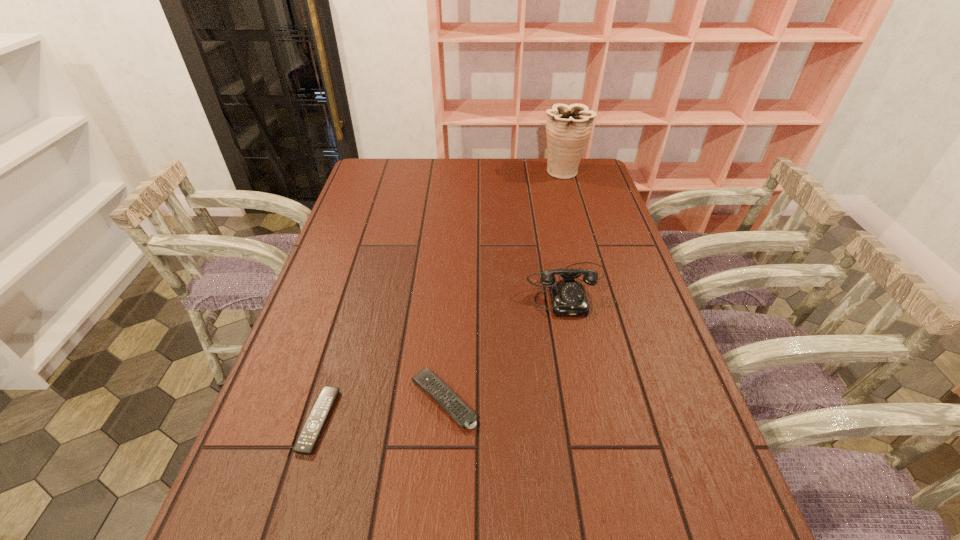
This screenshot has width=960, height=540. In order to click on vacant space in between the second farthest object and the left remote control in this screenshot , I will do `click(444, 354)`.

You are a GUI agent. You are given a task and a screenshot of the screen. Output one action in this format:
    pyautogui.click(x=<x>, y=<y>)
    Task: Click on the unoccupied area between the urn and the second farthest object
    The image size is (960, 540).
    Given the screenshot: What is the action you would take?
    pyautogui.click(x=565, y=230)

Locate which object ranks in proximity to the tallest object. Please provide its 2D coordinates. Your answer should be formatted as a tuple, i.e. [(x, y)], where the tuple contains the x and y coordinates of a point satisfying the conditions above.

[(568, 297)]

Choose which object is the nearest neighbor to the left remote control. Please provide its 2D coordinates. Your answer should be formatted as a tuple, i.e. [(x, y)], where the tuple contains the x and y coordinates of a point satisfying the conditions above.

[(427, 380)]

Locate an element on the screen. The width and height of the screenshot is (960, 540). vacant space that satisfies the following two spatial constraints: 1. on the back side of the right remote control; 2. on the right side of the leftmost object is located at coordinates (324, 400).

Where is `vacant space that satisfies the following two spatial constraints: 1. on the back side of the third tallest object; 2. on the right side of the urn`? The height and width of the screenshot is (540, 960). vacant space that satisfies the following two spatial constraints: 1. on the back side of the third tallest object; 2. on the right side of the urn is located at coordinates (460, 171).

Where is `blank space that satisfies the following two spatial constraints: 1. on the back side of the tallest object; 2. on the right side of the right remote control`? The height and width of the screenshot is (540, 960). blank space that satisfies the following two spatial constraints: 1. on the back side of the tallest object; 2. on the right side of the right remote control is located at coordinates (460, 171).